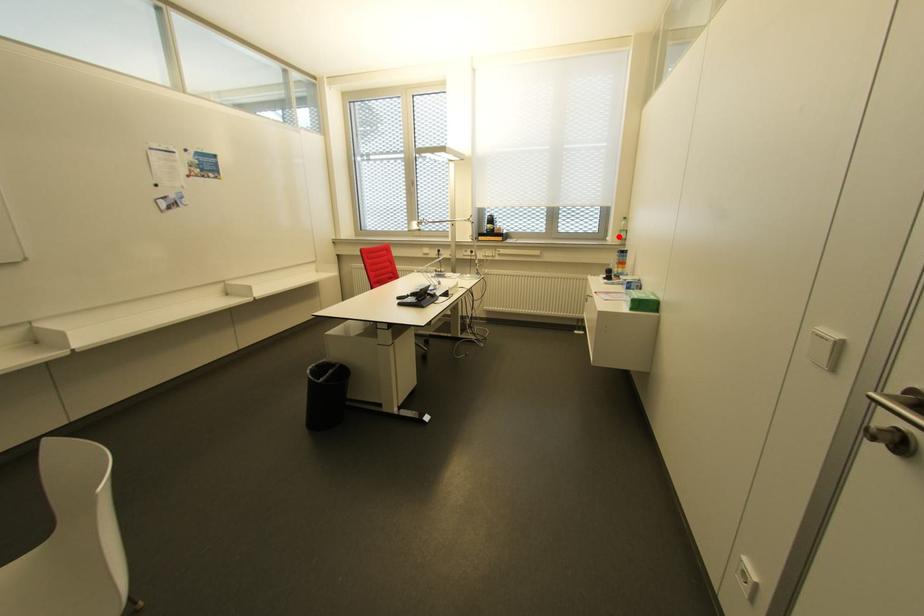
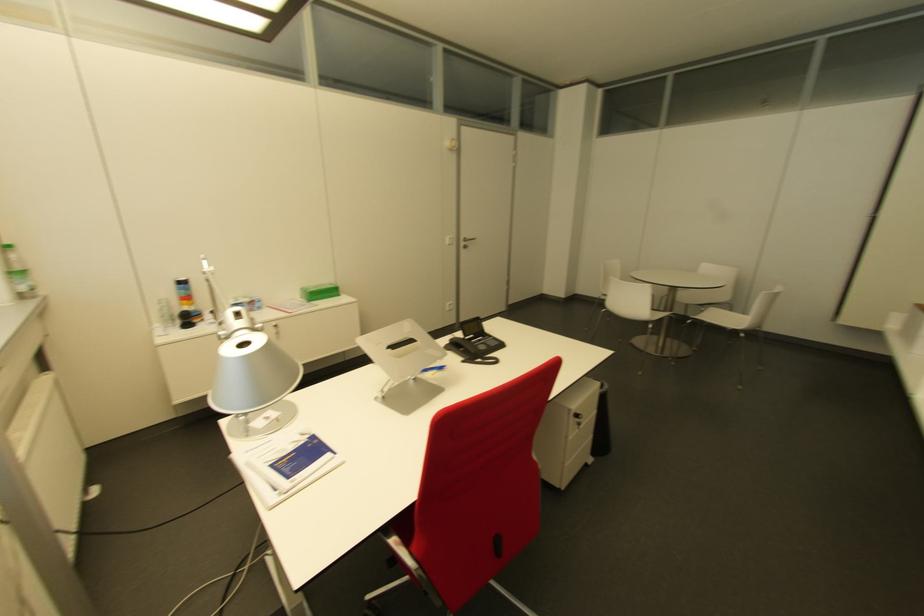
Locate, in the second image, the point that corresponds to the highlighted location in the first image.

(27, 284)